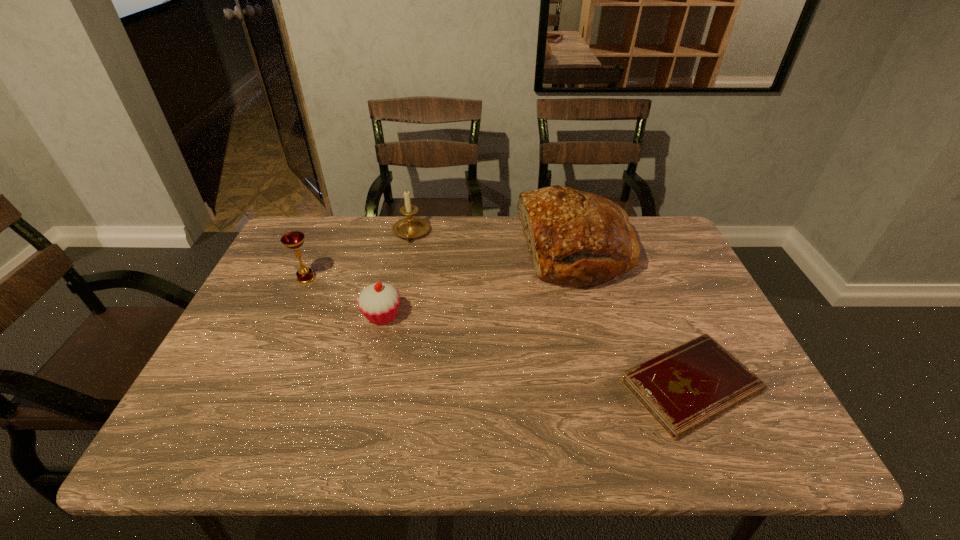
Where is `free location located with a handle on the side of the candle holder`? The height and width of the screenshot is (540, 960). free location located with a handle on the side of the candle holder is located at coordinates (405, 263).

Where is `vacant space located 0.170m on the back of the chalice`? This screenshot has height=540, width=960. vacant space located 0.170m on the back of the chalice is located at coordinates (324, 237).

You are a GUI agent. You are given a task and a screenshot of the screen. Output one action in this format:
    pyautogui.click(x=<x>, y=<y>)
    Task: Click on the vacant space located 0.060m on the left of the second nearest object
    
    Given the screenshot: What is the action you would take?
    pyautogui.click(x=338, y=316)

The image size is (960, 540). In order to click on vacant space located 0.310m on the left of the notebook in this screenshot , I will do `click(482, 386)`.

Image resolution: width=960 pixels, height=540 pixels. I want to click on bread present at the far edge, so click(576, 237).

Where is `candle holder that is at the far edge`? candle holder that is at the far edge is located at coordinates (411, 227).

Where is `object positioned at the near edge`? This screenshot has width=960, height=540. object positioned at the near edge is located at coordinates (691, 384).

Where is `object that is at the left edge`? This screenshot has width=960, height=540. object that is at the left edge is located at coordinates (294, 240).

The image size is (960, 540). I want to click on bread situated at the right edge, so click(576, 237).

The height and width of the screenshot is (540, 960). In order to click on notebook that is at the right edge in this screenshot , I will do `click(691, 384)`.